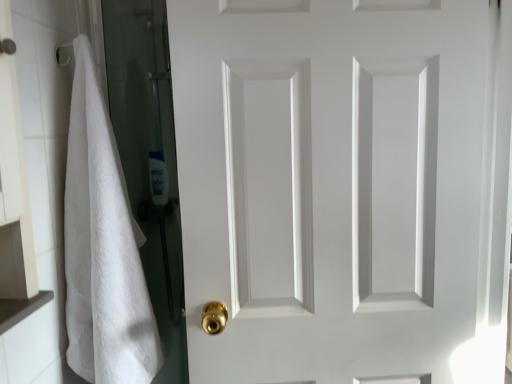
Question: Is white fluffy towel at left inside the boundaries of white matte door at center, or outside?

Choices:
 (A) inside
 (B) outside

Answer: (B)

Question: In the image, is white fluffy towel at left on the left side or the right side of white matte door at center?

Choices:
 (A) left
 (B) right

Answer: (A)

Question: Considering the positions of white fluffy towel at left and white matte door at center in the image, is white fluffy towel at left bigger or smaller than white matte door at center?

Choices:
 (A) big
 (B) small

Answer: (B)

Question: Looking at the image, does white matte door at center seem bigger or smaller compared to white fluffy towel at left?

Choices:
 (A) big
 (B) small

Answer: (A)

Question: Is white matte door at center wider or thinner than white fluffy towel at left?

Choices:
 (A) thin
 (B) wide

Answer: (A)

Question: From the image's perspective, is white matte door at center above or below white fluffy towel at left?

Choices:
 (A) below
 (B) above

Answer: (B)

Question: Considering their positions, is white matte door at center located in front of or behind white fluffy towel at left?

Choices:
 (A) front
 (B) behind

Answer: (B)